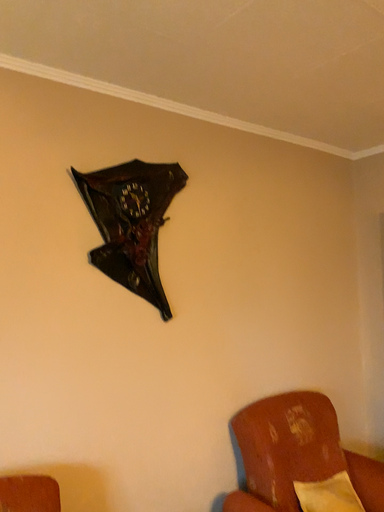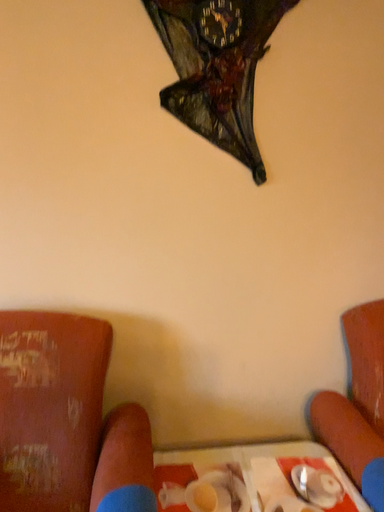
Question: Which way did the camera rotate in the video?

Choices:
 (A) rotated downward
 (B) rotated upward

Answer: (A)